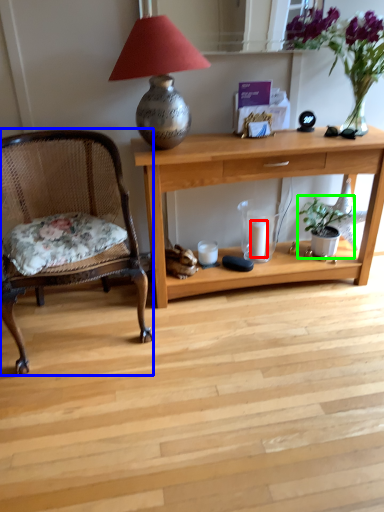
Question: Considering the real-world distances, which object is farthest from candle (highlighted by a red box)? chair (highlighted by a blue box) or houseplant (highlighted by a green box)?

Choices:
 (A) chair
 (B) houseplant

Answer: (A)